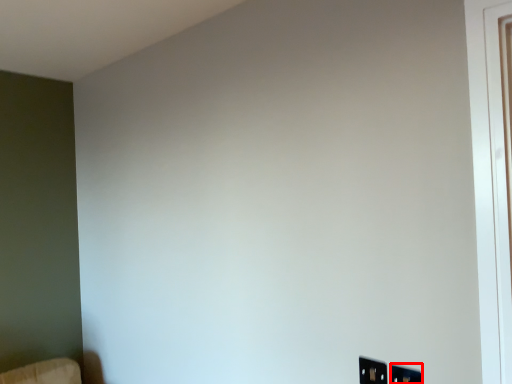
Question: From the image, what is the correct spatial relationship of electric outlet (annotated by the red box) in relation to electric outlet?

Choices:
 (A) left
 (B) right

Answer: (B)